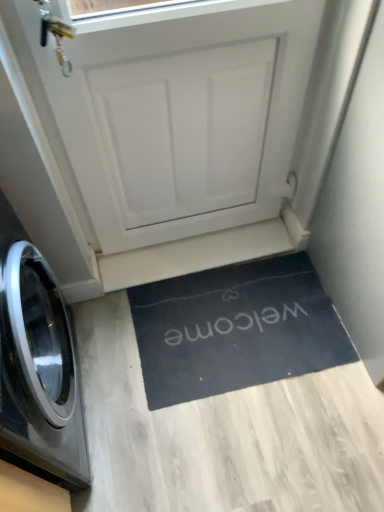
Question: Is black glossy washing machine at left further to camera compared to black rubber doormat at lower center?

Choices:
 (A) yes
 (B) no

Answer: (B)

Question: Is the depth of black glossy washing machine at left less than that of black rubber doormat at lower center?

Choices:
 (A) no
 (B) yes

Answer: (B)

Question: Is black glossy washing machine at left outside of black rubber doormat at lower center?

Choices:
 (A) no
 (B) yes

Answer: (B)

Question: From a real-world perspective, is black glossy washing machine at left physically above black rubber doormat at lower center?

Choices:
 (A) yes
 (B) no

Answer: (A)

Question: Is black glossy washing machine at left aimed at black rubber doormat at lower center?

Choices:
 (A) yes
 (B) no

Answer: (A)

Question: Does black glossy washing machine at left have a smaller size compared to black rubber doormat at lower center?

Choices:
 (A) yes
 (B) no

Answer: (B)

Question: Is black rubber doormat at lower center directly adjacent to white matte door at center?

Choices:
 (A) no
 (B) yes

Answer: (A)

Question: Is black rubber doormat at lower center to the right of white matte door at center from the viewer's perspective?

Choices:
 (A) yes
 (B) no

Answer: (A)

Question: Is black rubber doormat at lower center surrounding white matte door at center?

Choices:
 (A) no
 (B) yes

Answer: (A)

Question: From a real-world perspective, does black rubber doormat at lower center stand above white matte door at center?

Choices:
 (A) no
 (B) yes

Answer: (A)

Question: Is black rubber doormat at lower center far away from white matte door at center?

Choices:
 (A) no
 (B) yes

Answer: (A)

Question: Does black rubber doormat at lower center have a larger size compared to white matte door at center?

Choices:
 (A) no
 (B) yes

Answer: (A)

Question: Is black rubber doormat at lower center shorter than black glossy washing machine at left?

Choices:
 (A) no
 (B) yes

Answer: (B)